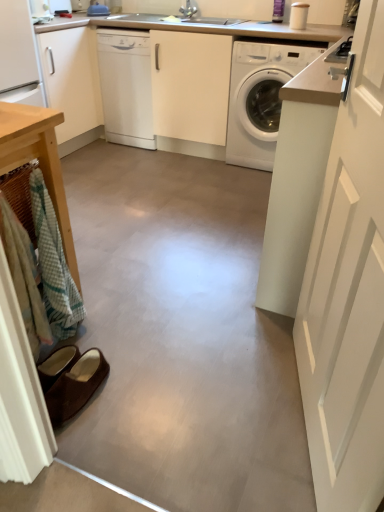
Find the location of a particular element. This screenshot has width=384, height=512. white glossy counter top at upper center is located at coordinates (162, 79).

What are the coordinates of `wooden table at left` in the screenshot? It's located at (38, 159).

Identify the location of white glossy dishwasher at center. (126, 87).

This screenshot has height=512, width=384. I want to click on smooth concrete floor at center, so click(182, 336).

What do you see at coordinates (76, 386) in the screenshot? This screenshot has height=512, width=384. I see `brown suede slippers at lower left` at bounding box center [76, 386].

Image resolution: width=384 pixels, height=512 pixels. I want to click on white glossy washing machine at center, so click(260, 98).

Identify the location of white glossy counter top at upper center. (162, 79).

From a real-world perspective, between smooth concrete floor at center and white matte cabinet at upper left, who is vertically higher?

white matte cabinet at upper left is physically above.

Between smooth concrete floor at center and white matte cabinet at upper left, which one is positioned behind?

white matte cabinet at upper left is further away from the camera.

Looking at this image, is smooth concrete floor at center positioned beyond the bounds of white matte cabinet at upper left?

Yes.

Between smooth concrete floor at center and white matte cabinet at upper left, which one has more height?

With more height is white matte cabinet at upper left.

From a real-world perspective, is white glossy dishwasher at center above or below smooth concrete floor at center?

In terms of real-world spatial position, white glossy dishwasher at center is above smooth concrete floor at center.

Is point (111, 32) farther from camera compared to point (170, 349)?

Yes.

Considering the positions of objects white glossy dishwasher at center and smooth concrete floor at center in the image provided, who is more to the right, white glossy dishwasher at center or smooth concrete floor at center?

smooth concrete floor at center is more to the right.

Is white glossy counter top at upper center far from white matte cabinet at upper left?

That's not correct — white glossy counter top at upper center is a little close to white matte cabinet at upper left.

Is white glossy counter top at upper center completely or partially outside of white matte cabinet at upper left?

Yes, white glossy counter top at upper center is outside of white matte cabinet at upper left.

In the scene shown: Is white glossy counter top at upper center at the right side of white matte cabinet at upper left?

Yes, white glossy counter top at upper center is to the right of white matte cabinet at upper left.

Is white matte cabinet at upper left oriented towards white glossy dishwasher at center?

No, white matte cabinet at upper left does not turn towards white glossy dishwasher at center.

Is white matte cabinet at upper left shorter than white glossy dishwasher at center?

No, white matte cabinet at upper left is not shorter than white glossy dishwasher at center.

Would you say white matte cabinet at upper left contains white glossy dishwasher at center?

No, white glossy dishwasher at center is located outside of white matte cabinet at upper left.

In the image, is white matte cabinet at upper left positioned in front of or behind white glossy dishwasher at center?

In the image, white matte cabinet at upper left appears in front of white glossy dishwasher at center.

Measure the distance from brown suede slippers at lower left to white glossy washing machine at center.

The distance of brown suede slippers at lower left from white glossy washing machine at center is 2.09 meters.

Considering the relative positions of brown suede slippers at lower left and white glossy washing machine at center in the image provided, is brown suede slippers at lower left behind white glossy washing machine at center?

No.

Between brown suede slippers at lower left and white glossy washing machine at center, which one appears on the right side from the viewer's perspective?

white glossy washing machine at center is more to the right.

From a real-world perspective, which object stands above the other?

white glossy washing machine at center, from a real-world perspective.

Consider the image. Which of these two, white glossy dishwasher at center or white matte door at right, stands taller?

white matte door at right is taller.

Could you tell me if white glossy dishwasher at center is facing white matte door at right?

No.

Is point (102, 65) closer or farther from the camera than point (379, 126)?

Clearly, point (102, 65) is more distant from the camera than point (379, 126).

Who is smaller, white glossy dishwasher at center or white matte door at right?

white matte door at right.

Which of these two, white matte door at right or white glossy counter top at upper center, is bigger?

white glossy counter top at upper center.

Is white matte door at right at the right side of white glossy counter top at upper center?

Yes.

Considering the relative sizes of white matte door at right and white glossy counter top at upper center in the image provided, is white matte door at right taller than white glossy counter top at upper center?

Indeed, white matte door at right has a greater height compared to white glossy counter top at upper center.

Is white matte door at right located outside white glossy counter top at upper center?

Indeed, white matte door at right is completely outside white glossy counter top at upper center.

Where is `cabinetry above the smooth concrete floor at center (from a real-world perspective)`? Image resolution: width=384 pixels, height=512 pixels. cabinetry above the smooth concrete floor at center (from a real-world perspective) is located at coordinates (72, 84).

Where is `concrete on the right of white glossy dishwasher at center`? Image resolution: width=384 pixels, height=512 pixels. concrete on the right of white glossy dishwasher at center is located at coordinates (182, 336).

From the image, which object appears to be farther from wooden table at left, white glossy counter top at upper center or brown suede slippers at lower left?

The object further to wooden table at left is white glossy counter top at upper center.

From the image, which object appears to be nearer to brown suede slippers at lower left, white glossy washing machine at center or wooden table at left?

wooden table at left is positioned closer to the anchor brown suede slippers at lower left.

When comparing their distances from white matte cabinet at upper left, does white glossy washing machine at center or white glossy dishwasher at center seem closer?

white glossy dishwasher at center.

Based on their spatial positions, is white glossy counter top at upper center or white matte door at right closer to brown suede slippers at lower left?

white matte door at right.

Which object lies nearer to the anchor point smooth concrete floor at center, white glossy counter top at upper center or wooden table at left?

wooden table at left is closer to smooth concrete floor at center.

Considering their positions, is white matte cabinet at upper left positioned further to smooth concrete floor at center than white glossy washing machine at center?

white matte cabinet at upper left is further to smooth concrete floor at center.

Looking at the image, which one is located further to white glossy counter top at upper center, wooden table at left or white matte door at right?

white matte door at right is further to white glossy counter top at upper center.

From the image, which object appears to be farther from white glossy washing machine at center, white matte cabinet at upper left or brown suede slippers at lower left?

brown suede slippers at lower left lies further to white glossy washing machine at center than the other object.

The width and height of the screenshot is (384, 512). Find the location of `counter top between white matte door at right and white glossy dishwasher at center from front to back`. counter top between white matte door at right and white glossy dishwasher at center from front to back is located at coordinates (162, 79).

Where is `concrete between wooden table at left and white glossy washing machine at center along the z-axis`? This screenshot has height=512, width=384. concrete between wooden table at left and white glossy washing machine at center along the z-axis is located at coordinates (182, 336).

Where is `concrete between white matte door at right and white glossy washing machine at center in the front-back direction`? The width and height of the screenshot is (384, 512). concrete between white matte door at right and white glossy washing machine at center in the front-back direction is located at coordinates (182, 336).

Where is `concrete that lies between white matte cabinet at upper left and brown suede slippers at lower left from top to bottom`? concrete that lies between white matte cabinet at upper left and brown suede slippers at lower left from top to bottom is located at coordinates (182, 336).